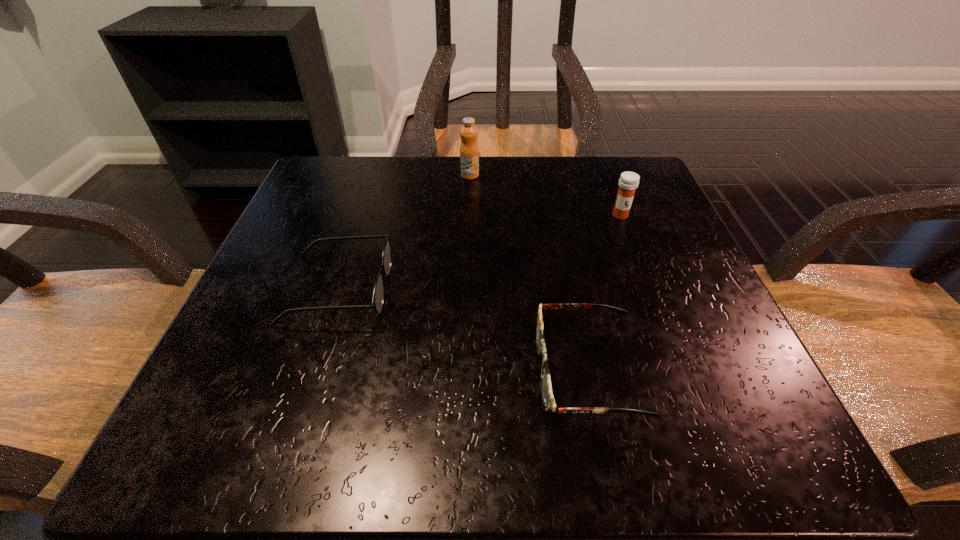
Locate an element on the screen. This screenshot has width=960, height=540. the second object from left to right is located at coordinates (469, 152).

The height and width of the screenshot is (540, 960). In order to click on the farthest object in this screenshot , I will do `click(469, 152)`.

Find the location of a particular element. the second farthest object is located at coordinates (628, 183).

The width and height of the screenshot is (960, 540). What are the coordinates of `the second tallest object` in the screenshot? It's located at click(x=628, y=183).

Locate an element on the screen. the left spectacles is located at coordinates [378, 295].

You are a GUI agent. You are given a task and a screenshot of the screen. Output one action in this format:
    pyautogui.click(x=<x>, y=<y>)
    Task: Click on the second object from right to left
    The height and width of the screenshot is (540, 960).
    Given the screenshot: What is the action you would take?
    pyautogui.click(x=549, y=403)

Locate an element on the screen. This screenshot has height=540, width=960. vacant space located on the front label of the tallest object is located at coordinates (468, 225).

Locate an element on the screen. vacant position located on the label side of the medicine is located at coordinates (641, 271).

At what (x,y) coordinates should I click in order to perform the action: click on vacant space located 0.120m on the front-facing side of the left spectacles. Please return your answer as a coordinate pair (x, y). Looking at the image, I should click on (462, 289).

The height and width of the screenshot is (540, 960). In order to click on free location located 0.390m on the frame of the right spectacles in this screenshot , I will do `click(251, 371)`.